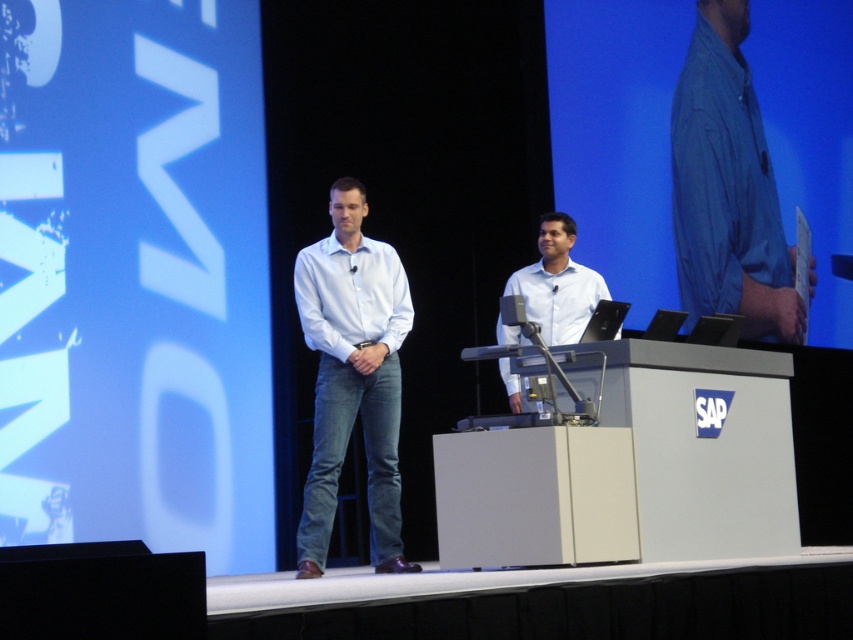
Question: Is white smooth shirt at center bigger than light blue shirt at center?

Choices:
 (A) yes
 (B) no

Answer: (B)

Question: Considering the relative positions of blue cotton shirt at upper right and light blue shirt at center in the image provided, where is blue cotton shirt at upper right located with respect to light blue shirt at center?

Choices:
 (A) below
 (B) above

Answer: (B)

Question: Which of the following is the farthest from the observer?

Choices:
 (A) white smooth shirt at center
 (B) blue cotton shirt at upper right
 (C) white cotton shirt at center

Answer: (B)

Question: From the image, what is the correct spatial relationship of white cotton shirt at center in relation to white smooth shirt at center?

Choices:
 (A) above
 (B) below

Answer: (B)

Question: Which point is farther to the camera?

Choices:
 (A) (770, 234)
 (B) (316, 288)

Answer: (A)

Question: Which is nearer to the white cotton shirt at center?

Choices:
 (A) white smooth shirt at center
 (B) blue cotton shirt at upper right

Answer: (A)